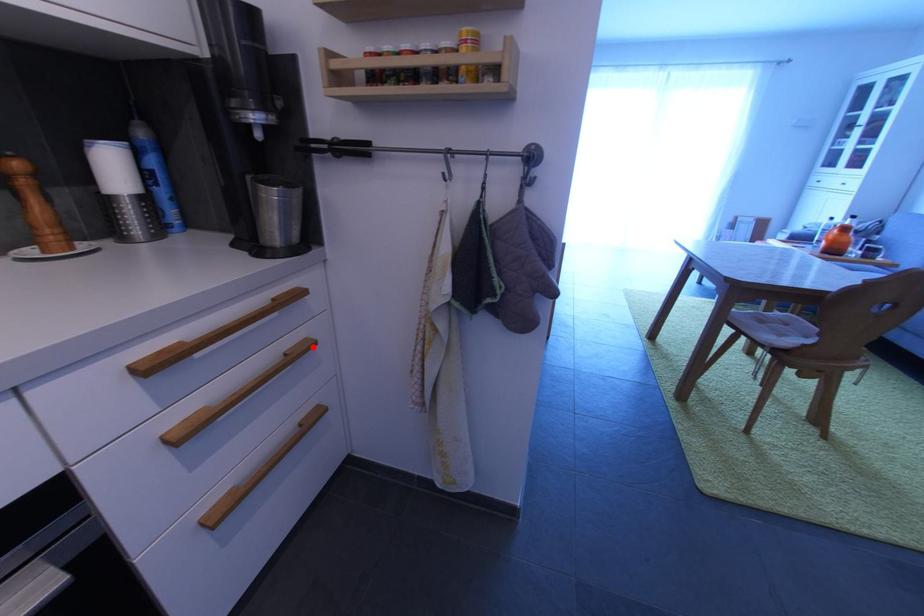
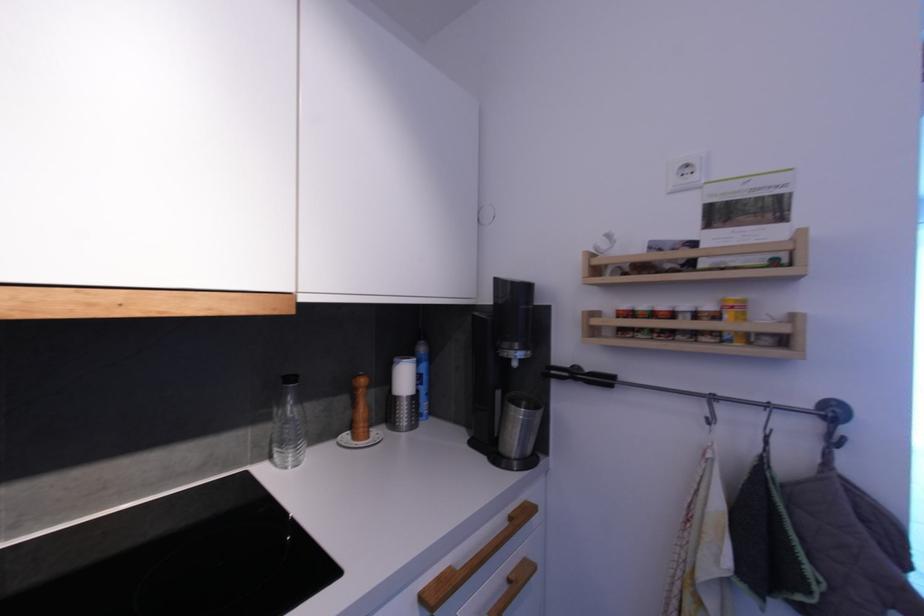
In the second image, find the point that corresponds to the highlighted location in the first image.

(532, 570)